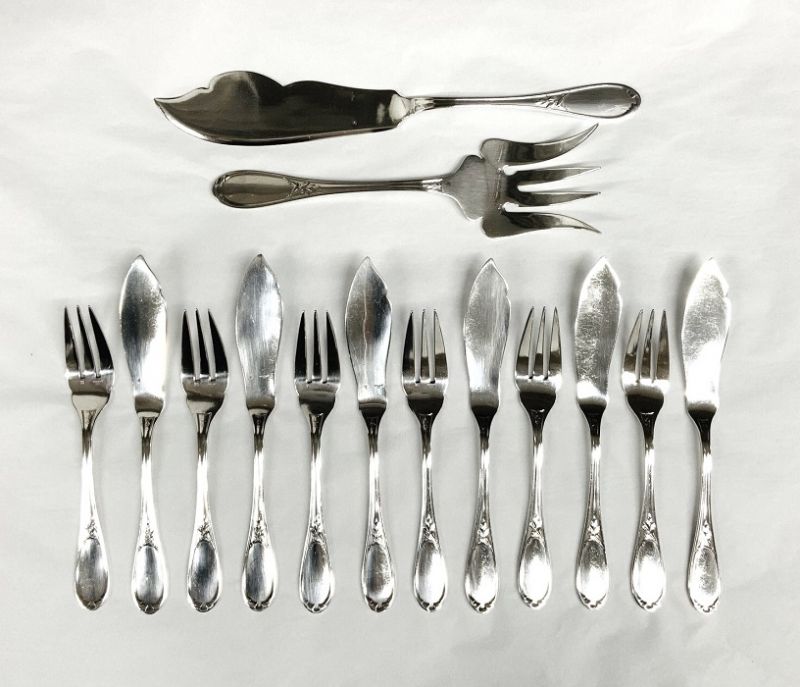
Find the location of a particular element. forks is located at coordinates (88, 541), (202, 547), (317, 554), (432, 556), (542, 572), (650, 572), (461, 183).